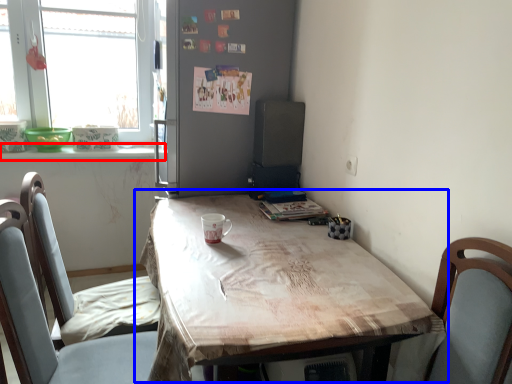
Question: Which point is further to the camera, window sill (highlighted by a red box) or table (highlighted by a blue box)?

Choices:
 (A) window sill
 (B) table

Answer: (A)